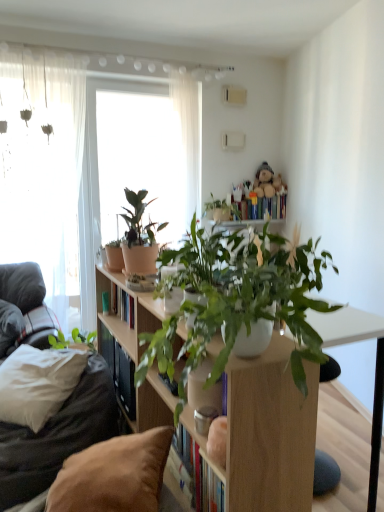
Question: Can you confirm if translucent fabric at left, the 1th window in the left-to-right sequence, is positioned to the left of brown fabric pillow at lower left, the 2th pillow in the top-to-bottom sequence?

Choices:
 (A) no
 (B) yes

Answer: (B)

Question: Is translucent fabric at left, the 1th window in the left-to-right sequence, further to camera compared to brown fabric pillow at lower left, marked as the 1th pillow in a front-to-back arrangement?

Choices:
 (A) no
 (B) yes

Answer: (B)

Question: From the image's perspective, does translucent fabric at left, which is the second window from right to left, appear higher than brown fabric pillow at lower left, which is the 1th pillow from bottom to top?

Choices:
 (A) no
 (B) yes

Answer: (B)

Question: Is translucent fabric at left, which is the second window from right to left, far away from brown fabric pillow at lower left, the 1th pillow positioned from the right?

Choices:
 (A) yes
 (B) no

Answer: (A)

Question: From a real-world perspective, does translucent fabric at left, the 1th window in the left-to-right sequence, stand above brown fabric pillow at lower left, which is counted as the second pillow, starting from the left?

Choices:
 (A) yes
 (B) no

Answer: (A)

Question: Is fluffy beige teddy bear at upper center bigger or smaller than translucent fabric at left, which is the second window from right to left?

Choices:
 (A) big
 (B) small

Answer: (B)

Question: From the image's perspective, is fluffy beige teddy bear at upper center above or below translucent fabric at left, the 1th window in the left-to-right sequence?

Choices:
 (A) above
 (B) below

Answer: (A)

Question: Is fluffy beige teddy bear at upper center inside the boundaries of translucent fabric at left, the 1th window in the left-to-right sequence, or outside?

Choices:
 (A) outside
 (B) inside

Answer: (A)

Question: In terms of width, does fluffy beige teddy bear at upper center look wider or thinner when compared to translucent fabric at left, which is the second window from right to left?

Choices:
 (A) wide
 (B) thin

Answer: (A)

Question: Considering the positions of matte terracotta pot at upper left, placed as the 2th houseplant when sorted from front to back, and white soft pillow at left, which appears as the 1th pillow when viewed from the left, in the image, is matte terracotta pot at upper left, placed as the 2th houseplant when sorted from front to back, taller or shorter than white soft pillow at left, which appears as the 1th pillow when viewed from the left,?

Choices:
 (A) tall
 (B) short

Answer: (A)

Question: Is matte terracotta pot at upper left, placed as the 2th houseplant when sorted from front to back, inside or outside of white soft pillow at left, which is the first pillow in top-to-bottom order?

Choices:
 (A) inside
 (B) outside

Answer: (B)

Question: Is matte terracotta pot at upper left, placed as the 2th houseplant when sorted from front to back, to the left or to the right of white soft pillow at left, which is the first pillow in top-to-bottom order, in the image?

Choices:
 (A) right
 (B) left

Answer: (A)

Question: From a real-world perspective, is matte terracotta pot at upper left, which is counted as the first houseplant, starting from the back, above or below white soft pillow at left, which is the first pillow in top-to-bottom order?

Choices:
 (A) above
 (B) below

Answer: (A)

Question: Is hardcover books at upper center taller or shorter than white soft pillow at left, which is the first pillow in top-to-bottom order?

Choices:
 (A) short
 (B) tall

Answer: (A)

Question: Looking at the image, does hardcover books at upper center seem bigger or smaller compared to white soft pillow at left, placed as the second pillow when sorted from right to left?

Choices:
 (A) small
 (B) big

Answer: (A)